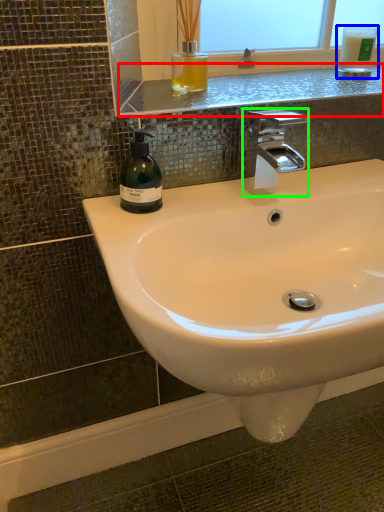
Question: Based on their relative distances, which object is nearer to window sill (highlighted by a red box)? Choose from mouthwash (highlighted by a blue box) and tap (highlighted by a green box).

Choices:
 (A) mouthwash
 (B) tap

Answer: (B)